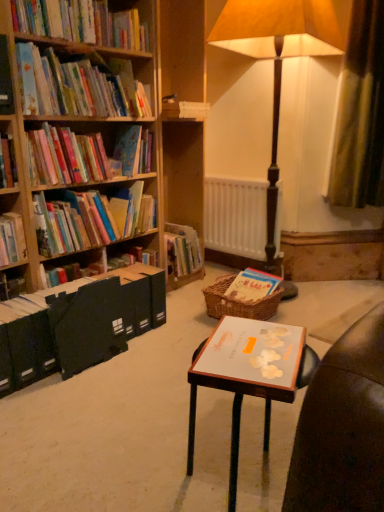
Question: Does matte paper bookshelf at upper left, the 4th book from the bottom, have a lesser width compared to brown woven picnic basket at center?

Choices:
 (A) no
 (B) yes

Answer: (B)

Question: Is matte paper bookshelf at upper left, the 4th book from the bottom, directly adjacent to brown woven picnic basket at center?

Choices:
 (A) no
 (B) yes

Answer: (A)

Question: Does matte paper bookshelf at upper left, which is counted as the 2th book, starting from the top, have a smaller size compared to brown woven picnic basket at center?

Choices:
 (A) no
 (B) yes

Answer: (A)

Question: Considering the relative positions of matte paper bookshelf at upper left, which is counted as the 2th book, starting from the top, and brown woven picnic basket at center in the image provided, is matte paper bookshelf at upper left, which is counted as the 2th book, starting from the top, to the right of brown woven picnic basket at center from the viewer's perspective?

Choices:
 (A) no
 (B) yes

Answer: (A)

Question: Is matte paper bookshelf at upper left, the 4th book from the bottom, taller than brown woven picnic basket at center?

Choices:
 (A) no
 (B) yes

Answer: (B)

Question: From the image's perspective, is wooden floor lamp at center positioned above or below matte paper bookshelf at upper left, which is counted as the 2th book, starting from the top?

Choices:
 (A) above
 (B) below

Answer: (B)

Question: Is wooden floor lamp at center taller or shorter than matte paper bookshelf at upper left, the 4th book from the bottom?

Choices:
 (A) short
 (B) tall

Answer: (B)

Question: Considering their positions, is wooden floor lamp at center located in front of or behind matte paper bookshelf at upper left, which is counted as the 2th book, starting from the top?

Choices:
 (A) front
 (B) behind

Answer: (B)

Question: Would you say wooden floor lamp at center is to the left or to the right of matte paper bookshelf at upper left, which is counted as the 2th book, starting from the top, in the picture?

Choices:
 (A) right
 (B) left

Answer: (A)

Question: From a real-world perspective, is white matte radiator at center positioned above or below matte paper book at left, which is the third book from top to bottom?

Choices:
 (A) below
 (B) above

Answer: (A)

Question: Is white matte radiator at center in front of or behind matte paper book at left, the third book when ordered from bottom to top, in the image?

Choices:
 (A) front
 (B) behind

Answer: (B)

Question: From their relative heights in the image, would you say white matte radiator at center is taller or shorter than matte paper book at left, the third book when ordered from bottom to top?

Choices:
 (A) tall
 (B) short

Answer: (A)

Question: Based on their positions, is white matte radiator at center located to the left or right of matte paper book at left, the third book when ordered from bottom to top?

Choices:
 (A) left
 (B) right

Answer: (B)

Question: Considering the relative positions of black matte file at left, which is counted as the first paperback book, starting from the left, and matte paper book at left, which is the third book from top to bottom, in the image provided, is black matte file at left, which is counted as the first paperback book, starting from the left, to the left or to the right of matte paper book at left, which is the third book from top to bottom,?

Choices:
 (A) right
 (B) left

Answer: (A)

Question: In terms of height, does black matte file at left, the second paperback book when ordered from right to left, look taller or shorter compared to matte paper book at left, the third book when ordered from bottom to top?

Choices:
 (A) tall
 (B) short

Answer: (A)